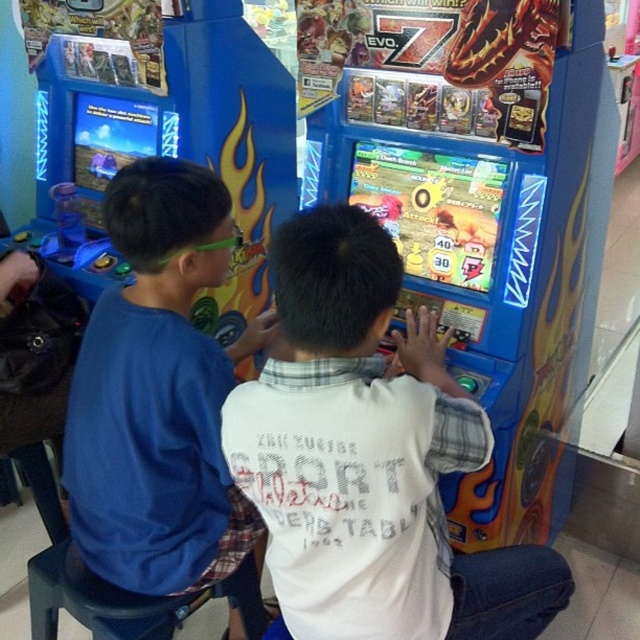
Question: Which object is farther from the camera taking this photo?

Choices:
 (A) white cotton shirt at center
 (B) blue plastic arcade game at center
 (C) blue cotton shirt at left

Answer: (B)

Question: Which of the following is the farthest from the observer?

Choices:
 (A) (458, 134)
 (B) (410, 378)
 (C) (116, 346)

Answer: (A)

Question: Which object is positioned closest to the blue plastic arcade game at center?

Choices:
 (A) white cotton shirt at center
 (B) blue cotton shirt at left

Answer: (A)

Question: Is white cotton shirt at center closer to the viewer compared to blue cotton shirt at left?

Choices:
 (A) yes
 (B) no

Answer: (A)

Question: Does white cotton shirt at center come in front of blue cotton shirt at left?

Choices:
 (A) no
 (B) yes

Answer: (B)

Question: Can you confirm if blue plastic arcade game at center is thinner than white cotton shirt at center?

Choices:
 (A) yes
 (B) no

Answer: (B)